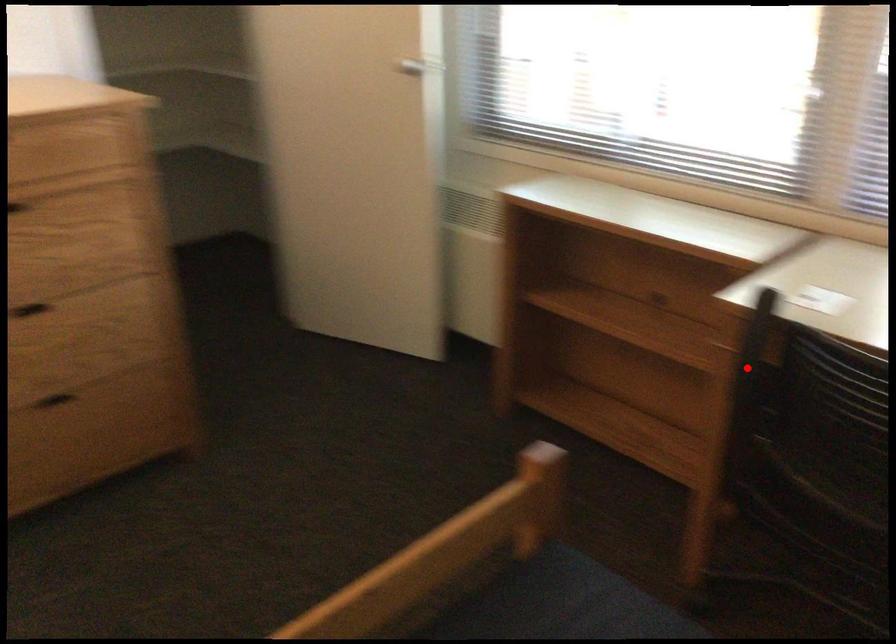
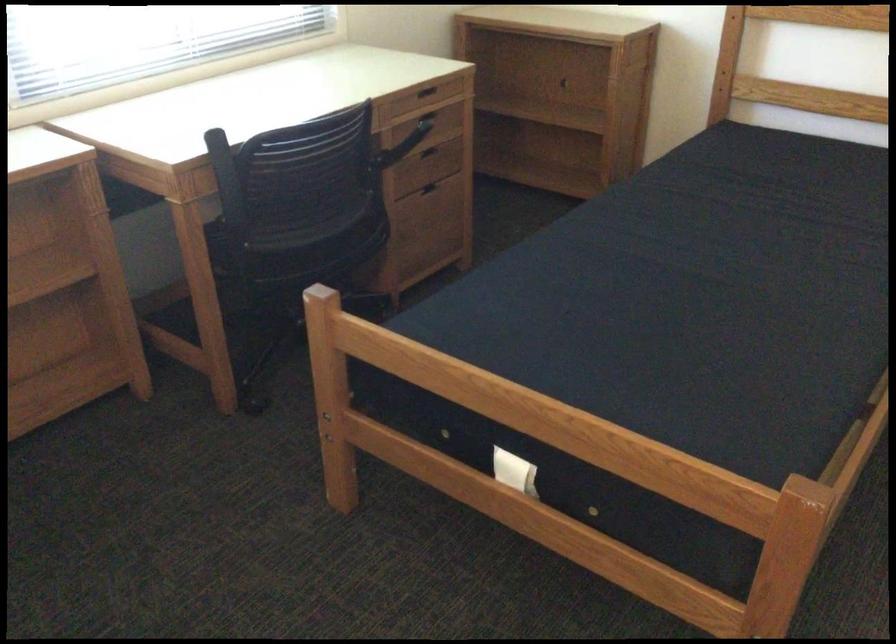
In the second image, find the point that corresponds to the highlighted location in the first image.

(227, 182)